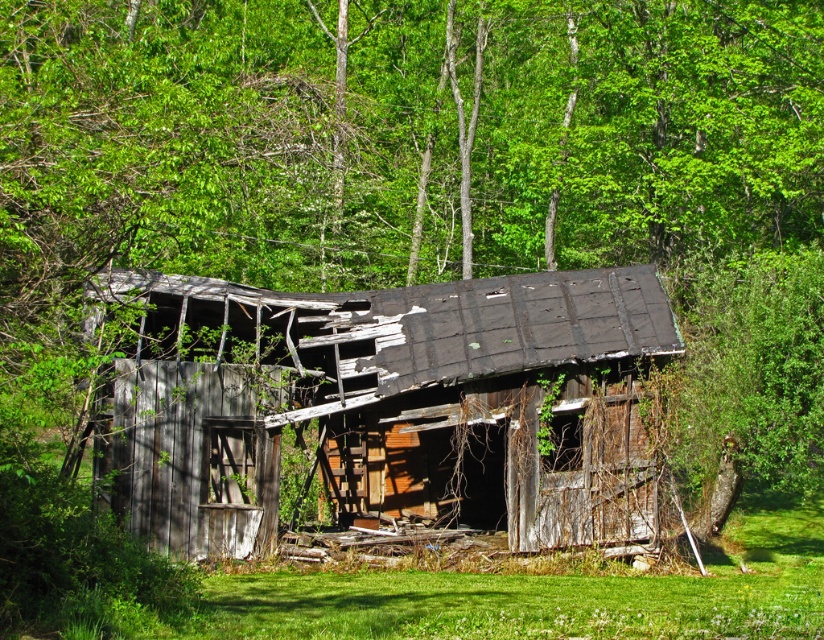
Question: Considering the relative positions of weathered wood barn at center and green grass at lower center in the image provided, where is weathered wood barn at center located with respect to green grass at lower center?

Choices:
 (A) left
 (B) right

Answer: (A)

Question: Which object appears closest to the camera in this image?

Choices:
 (A) green grass at lower center
 (B) weathered wood barn at center

Answer: (A)

Question: Which object appears farthest from the camera in this image?

Choices:
 (A) green grass at lower center
 (B) weathered wood barn at center

Answer: (B)

Question: In this image, where is weathered wood barn at center located relative to green grass at lower center?

Choices:
 (A) above
 (B) below

Answer: (A)

Question: Which of the following is the closest to the observer?

Choices:
 (A) green grass at lower center
 (B) weathered wood barn at center

Answer: (A)

Question: Does weathered wood barn at center come in front of green grass at lower center?

Choices:
 (A) no
 (B) yes

Answer: (A)